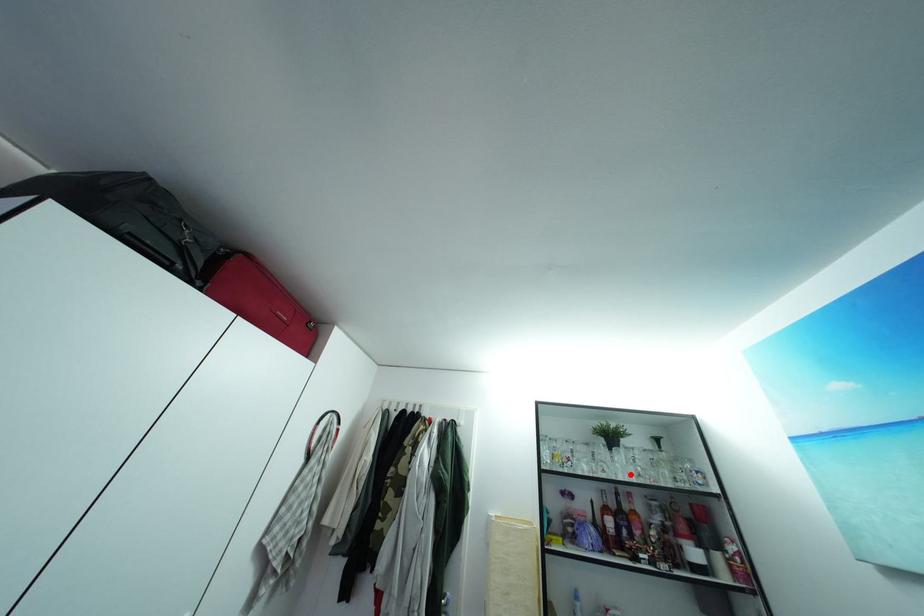
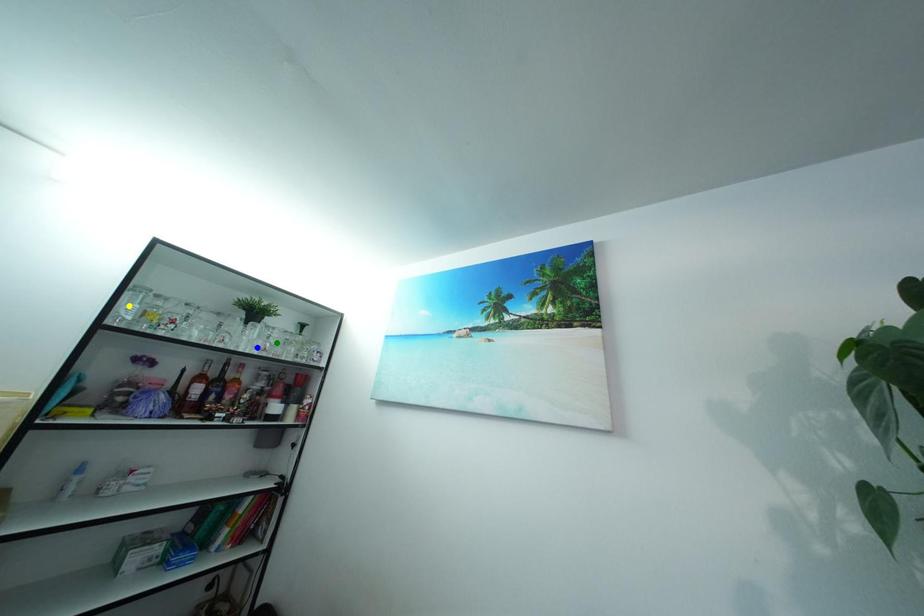
Question: I am providing you with two images of the same scene from different viewpoints. A red point is marked on the first image. You are given multiple points on the second image. Which point in image 2 represents the same 3d spot as the red point in image 1?

Choices:
 (A) blue point
 (B) green point
 (C) yellow point

Answer: (A)